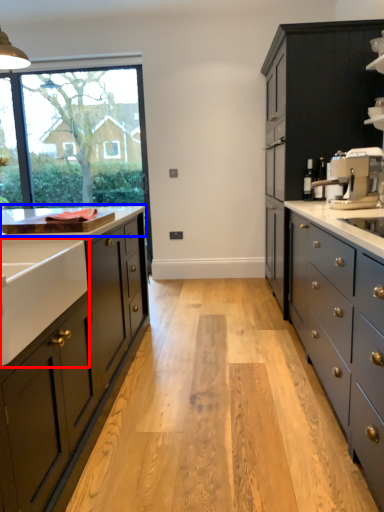
Question: Which of the following is the closest to the observer, sink (highlighted by a red box) or countertop (highlighted by a blue box)?

Choices:
 (A) sink
 (B) countertop

Answer: (A)